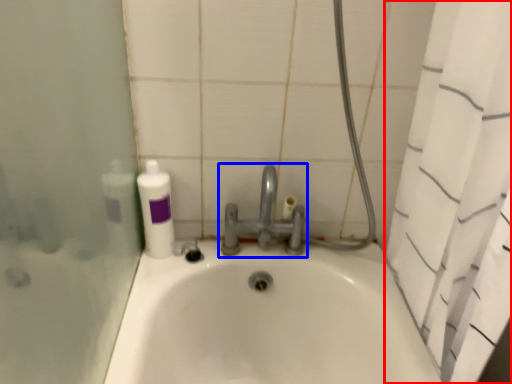
Question: Among these objects, which one is farthest to the camera, shower curtain (highlighted by a red box) or tap (highlighted by a blue box)?

Choices:
 (A) shower curtain
 (B) tap

Answer: (B)